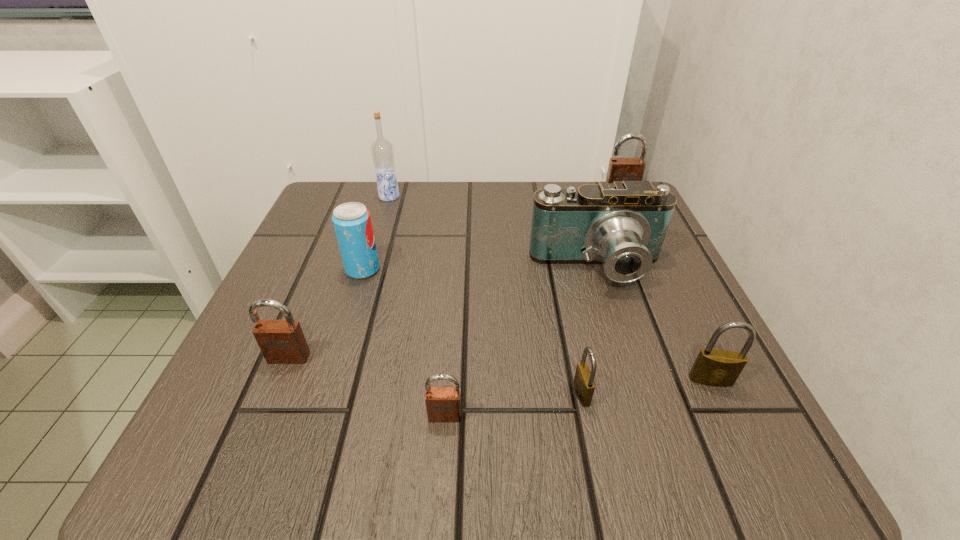
The width and height of the screenshot is (960, 540). I want to click on blue vodka, so click(382, 151).

This screenshot has width=960, height=540. In order to click on vodka in this screenshot , I will do 382,151.

Locate an element on the screen. The height and width of the screenshot is (540, 960). the farthest brown padlock is located at coordinates (620, 169).

Image resolution: width=960 pixels, height=540 pixels. I want to click on the biggest brown padlock, so [620, 169].

The height and width of the screenshot is (540, 960). I want to click on camcorder, so click(x=623, y=225).

I want to click on soda can, so click(x=352, y=222).

Identify the location of the leftmost padlock. This screenshot has height=540, width=960. (281, 341).

I want to click on the leftmost brown padlock, so click(281, 341).

The width and height of the screenshot is (960, 540). I want to click on the bigger brass padlock, so click(713, 367).

In order to click on the smaller brass padlock in this screenshot , I will do (584, 385).